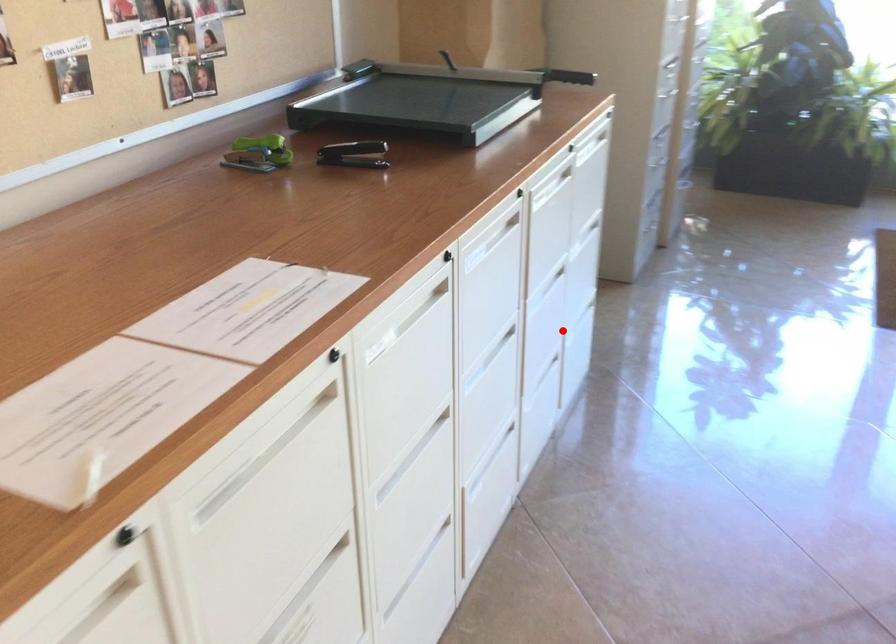
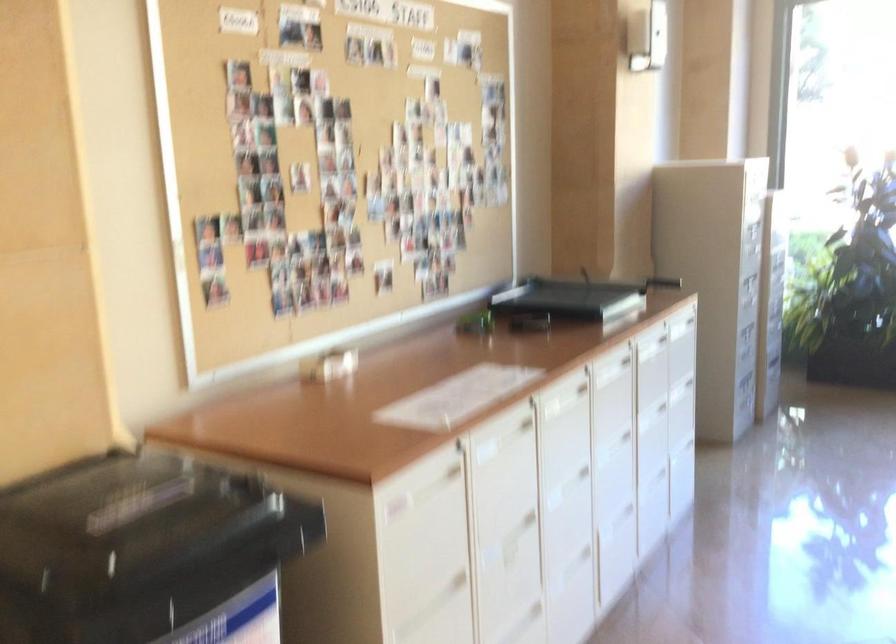
Question: I am providing you with two images of the same scene from different viewpoints. A red point is marked on the first image. Is the red point's position out of view in image 2?

Choices:
 (A) Yes
 (B) No

Answer: (B)